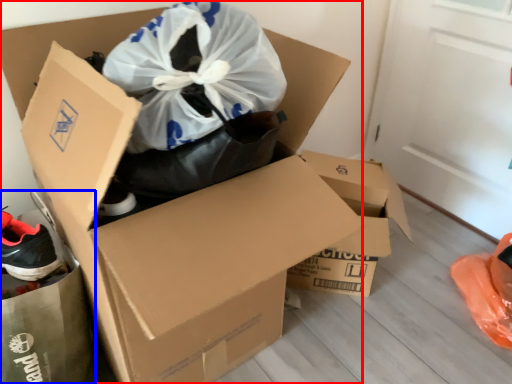
Question: Which of the following is the farthest to the observer, box (highlighted by a red box) or garbage (highlighted by a blue box)?

Choices:
 (A) box
 (B) garbage

Answer: (B)